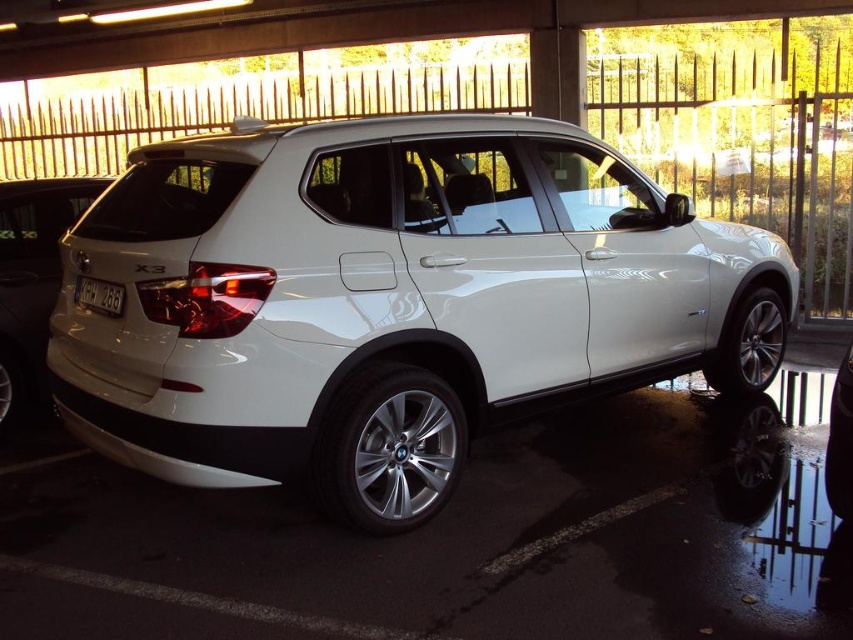
You are a parking attendant who needs to direct a driver to park their car behind the white BMW X3. The driver wants to know if there is enough space between the white glossy minivan at lower left and the white plastic license plate at rear to park their vehicle. Can you confirm if there is sufficient space?

The white glossy minivan at lower left is located above the white plastic license plate at rear, meaning there is vertical space between them. However, since the minivan is positioned at the lower left and the license plate is at the rear, the horizontal space might be limited. Without specific measurements, it is difficult to confirm if there is enough space for parking.

Based on the scene description, what are the coordinates of the white glossy suv at center?

The white glossy suv at center is located at coordinates (390, 301).

You are a photographer standing in front of the white BMW X3 parked in the covered parking area. You want to take a photo that includes both point (x=173, y=481) and point (x=289, y=529). Which point should you focus on first to ensure both are in sharp focus?

You should focus on point (x=173, y=481) first because it is closer to the camera than point (x=289, y=529). By focusing on the closer point, the farther point will also be within the depth of field and in focus.